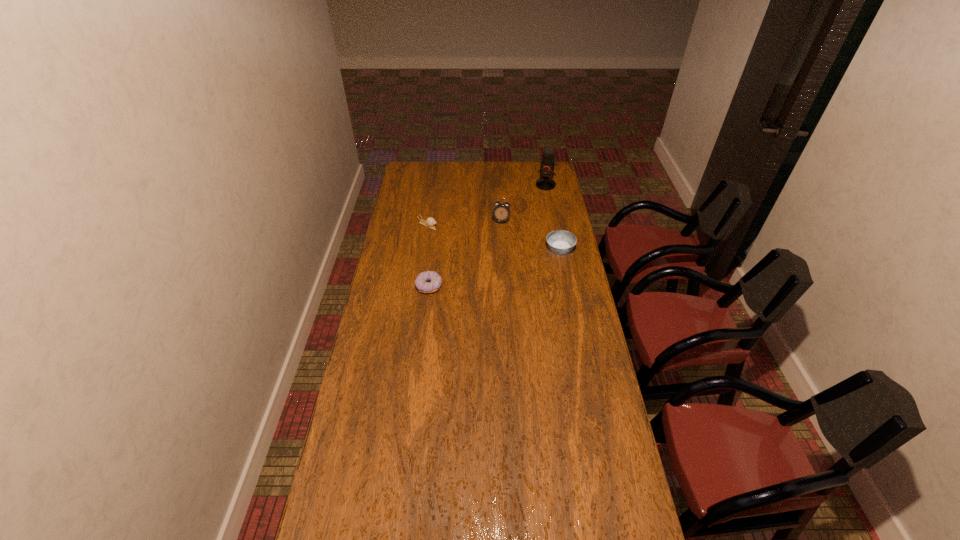
Image resolution: width=960 pixels, height=540 pixels. Find the location of `object at the left edge`. object at the left edge is located at coordinates (430, 222).

You are a GUI agent. You are given a task and a screenshot of the screen. Output one action in this format:
    pyautogui.click(x=<x>, y=<y>)
    Task: Click on the ashtray present at the right edge
    Image resolution: width=960 pixels, height=540 pixels.
    Given the screenshot: What is the action you would take?
    pyautogui.click(x=559, y=241)

This screenshot has width=960, height=540. Identify the location of microphone situated at the right edge. (547, 162).

This screenshot has width=960, height=540. Find the location of `object that is at the far right corner`. object that is at the far right corner is located at coordinates (547, 162).

Where is `free space at the far edge of the desktop`? The image size is (960, 540). free space at the far edge of the desktop is located at coordinates (517, 168).

This screenshot has height=540, width=960. Find the location of `vacant space at the near edge`. vacant space at the near edge is located at coordinates (498, 518).

The height and width of the screenshot is (540, 960). I want to click on vacant space at the left edge, so click(x=419, y=233).

Where is `free space at the right edge of the desktop`? free space at the right edge of the desktop is located at coordinates (555, 228).

Image resolution: width=960 pixels, height=540 pixels. In the image, there is a desktop. What are the coordinates of `vacant space at the far left corner` in the screenshot? It's located at (410, 181).

At what (x,y) coordinates should I click in order to perform the action: click on vacant space at the near left corner of the desktop. Please return your answer as a coordinate pair (x, y). The height and width of the screenshot is (540, 960). Looking at the image, I should click on (339, 516).